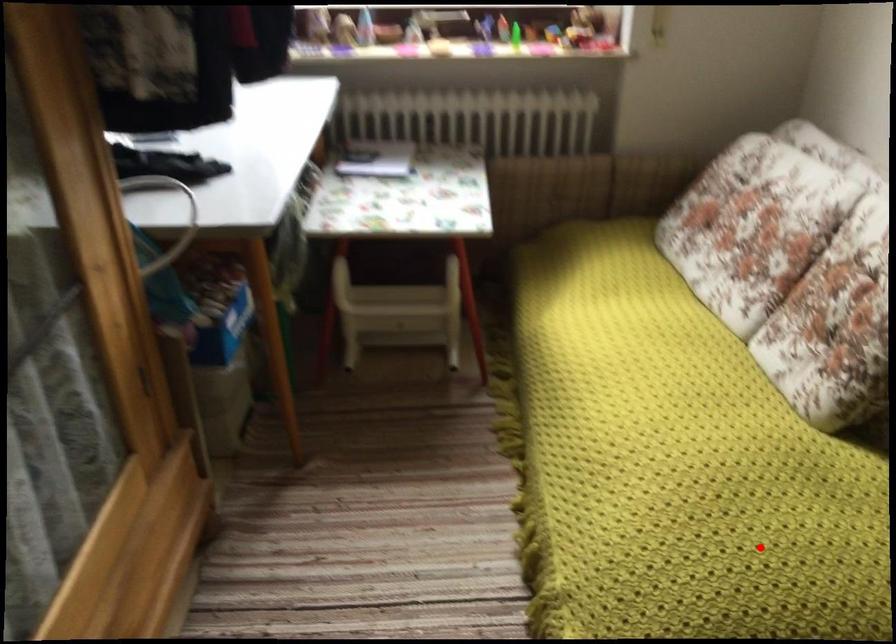
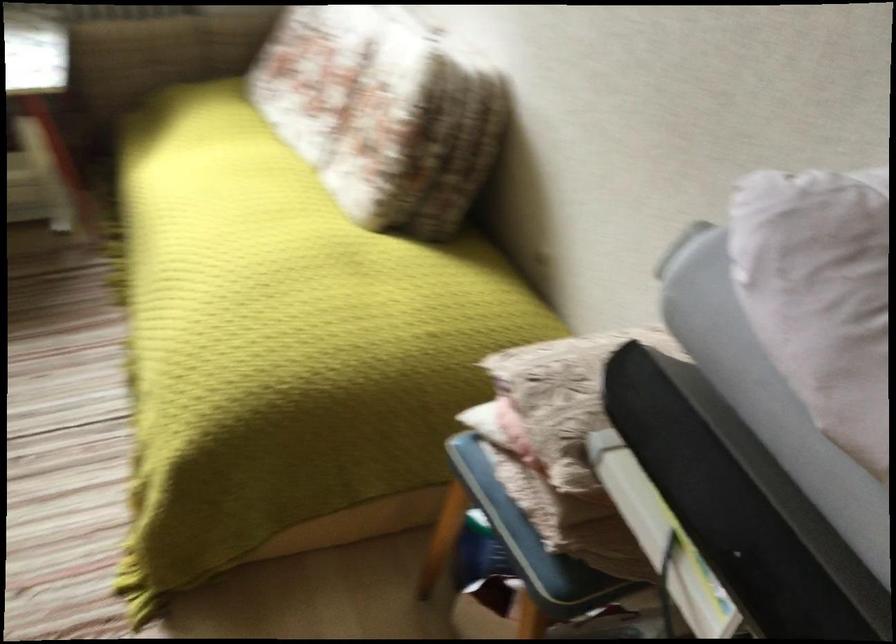
The point at the highlighted location is marked in the first image. Where is the corresponding point in the second image?

(290, 314)